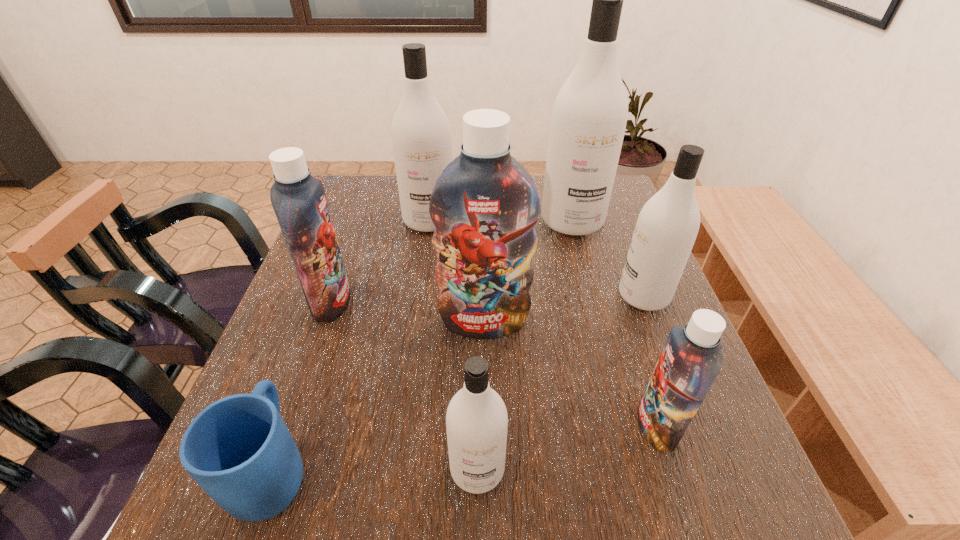
Find the location of a particular element. vacant point located 0.360m on the front label of the smallest blue shampoo is located at coordinates (432, 426).

Find the location of a particular element. Image resolution: width=960 pixels, height=540 pixels. vacant space located 0.180m on the front label of the smallest blue shampoo is located at coordinates (536, 426).

Where is `vacant space positioned 0.310m on the front label of the smallest blue shampoo`? vacant space positioned 0.310m on the front label of the smallest blue shampoo is located at coordinates pos(461,426).

Image resolution: width=960 pixels, height=540 pixels. Find the location of `free spot located 0.370m on the side of the mug with the handle`. free spot located 0.370m on the side of the mug with the handle is located at coordinates (340, 280).

At what (x,y) coordinates should I click in order to perform the action: click on vacant space situated 0.330m on the side of the mug with the handle. Please return your answer as a coordinate pair (x, y). Image resolution: width=960 pixels, height=540 pixels. Looking at the image, I should click on (336, 291).

At what (x,y) coordinates should I click in order to perform the action: click on vacant point located 0.180m on the side of the mug with the handle. Please return your answer as a coordinate pair (x, y). The width and height of the screenshot is (960, 540). Looking at the image, I should click on (318, 341).

You are a GUI agent. You are given a task and a screenshot of the screen. Output one action in this format:
    pyautogui.click(x=<x>, y=<y>)
    Task: Click on the shampoo at the near edge
    Image resolution: width=960 pixels, height=540 pixels.
    Given the screenshot: What is the action you would take?
    pyautogui.click(x=476, y=420)

Where is `mug positioned at the near edge`? mug positioned at the near edge is located at coordinates (238, 449).

What are the coordinates of `shampoo present at the left edge` in the screenshot? It's located at (299, 201).

Locate an element on the screen. Image resolution: width=960 pixels, height=540 pixels. mug that is at the left edge is located at coordinates (238, 449).